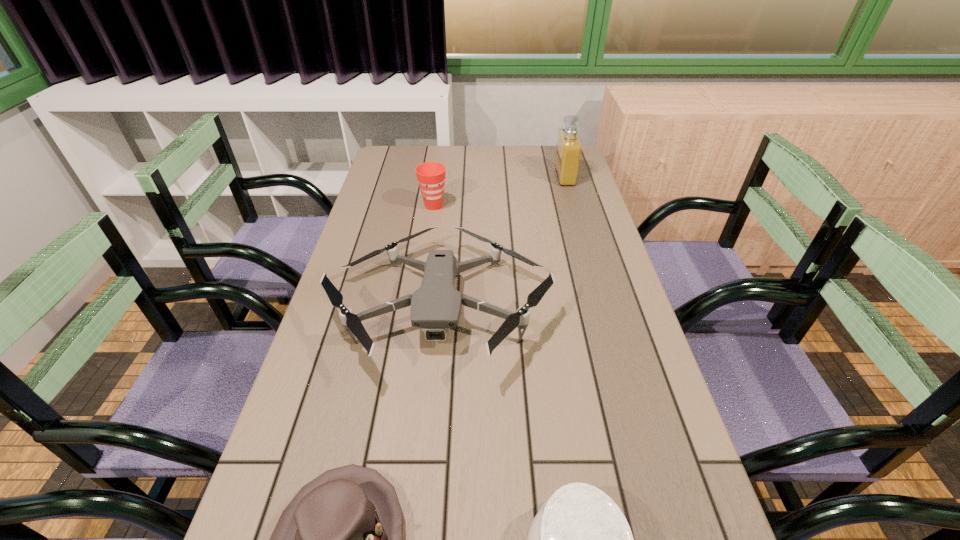
I want to click on the tallest object, so click(x=569, y=148).

Locate an element on the screen. perfume is located at coordinates pyautogui.click(x=569, y=148).

This screenshot has height=540, width=960. In order to click on the second farthest object in this screenshot , I will do `click(431, 175)`.

I want to click on the third farthest object, so click(x=436, y=306).

Find the location of `drone`. drone is located at coordinates coord(436,306).

In order to click on free spot located on the front-facing side of the farthest object in this screenshot , I will do `click(487, 177)`.

What are the coordinates of `free space located 0.250m on the front-facing side of the farthest object` in the screenshot? It's located at (490, 177).

Where is `free space located 0.400m on the front-facing side of the farthest object`? The image size is (960, 540). free space located 0.400m on the front-facing side of the farthest object is located at coordinates (449, 177).

Identify the location of vacant region located on the right of the cup. (489, 206).

Identify the location of free space located 0.160m on the front-facing side of the third farthest object. (426, 461).